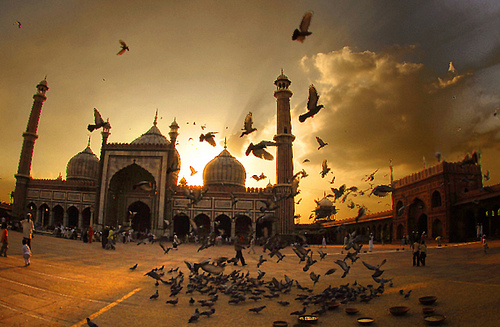
Find the location of `light`. light is located at coordinates [173, 126], [103, 129].